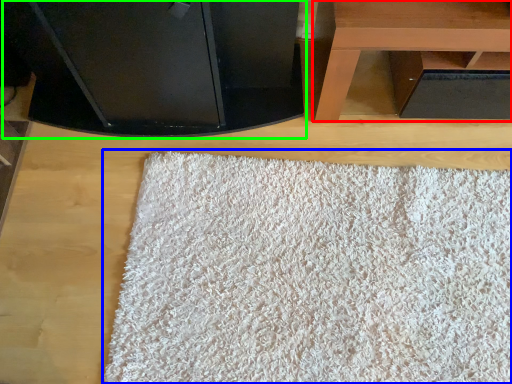
Question: Which is farther away from table (highlighted by a red box)? mat (highlighted by a blue box) or furniture (highlighted by a green box)?

Choices:
 (A) mat
 (B) furniture

Answer: (A)